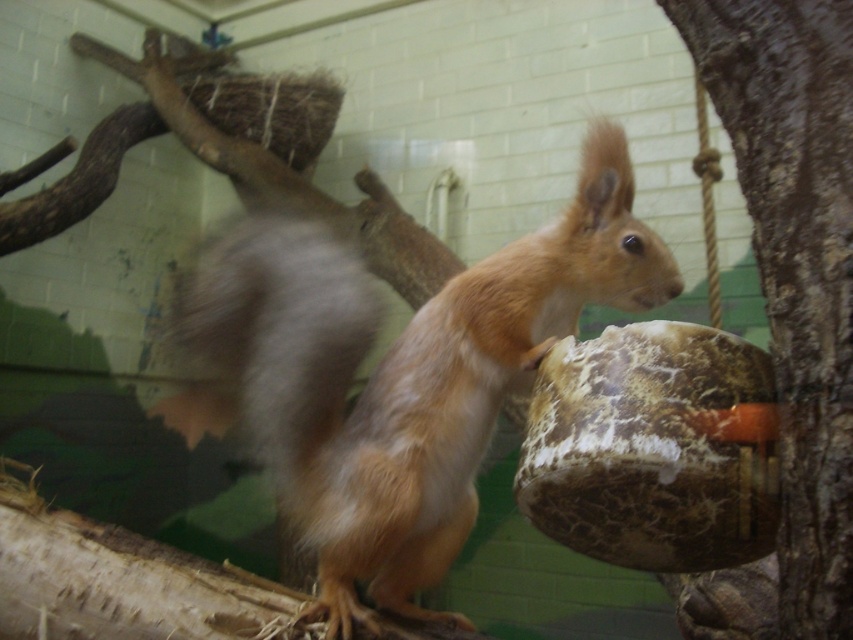
Consider the image. You are a zookeeper observing the enclosure. You notice the fluffy brown squirrel at center and the brown rough bark at right. Which object is taller?

The fluffy brown squirrel at center is taller than the brown rough bark at right.

You are a zookeeper observing the enclosure. There is a point at coordinate (401, 372) in the image. Which object is this point located on?

The point at coordinate (401, 372) is located on the fluffy brown squirrel at center.